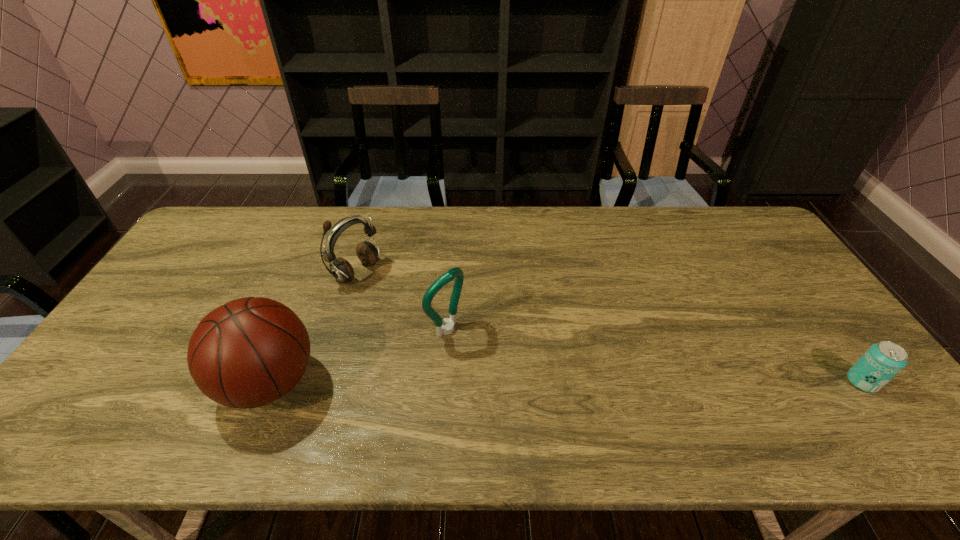
Locate an element on the screen. vacant space located on the ear pads of the farthest object is located at coordinates (392, 294).

Identify the location of free space located on the ear pads of the farthest object. The height and width of the screenshot is (540, 960). (431, 319).

Identify the location of vacant area situated on the ear pads of the farthest object. The image size is (960, 540). (384, 290).

This screenshot has width=960, height=540. Identify the location of basketball that is at the near edge. (249, 352).

You are a GUI agent. You are given a task and a screenshot of the screen. Output one action in this format:
    pyautogui.click(x=<x>, y=<y>)
    Task: Click on the beer can that is at the near edge
    This screenshot has width=960, height=540.
    Given the screenshot: What is the action you would take?
    pyautogui.click(x=882, y=361)

Find the location of `object situated at the right edge`. object situated at the right edge is located at coordinates (882, 361).

Locate an element on the screen. object that is at the near right corner is located at coordinates (882, 361).

Identify the location of vacant region at the far edge of the desktop. The width and height of the screenshot is (960, 540). pyautogui.click(x=611, y=231).

The width and height of the screenshot is (960, 540). I want to click on vacant area at the near edge of the desktop, so click(673, 400).

Find the location of a particular element. free space at the left edge is located at coordinates (194, 286).